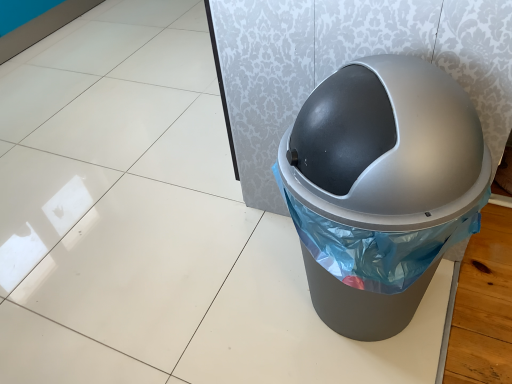
At what (x,y) coordinates should I click in order to perform the action: click on free space to the left of satin silver trash can at center. Please return your answer as a coordinate pair (x, y). This screenshot has width=512, height=384. Looking at the image, I should click on (220, 300).